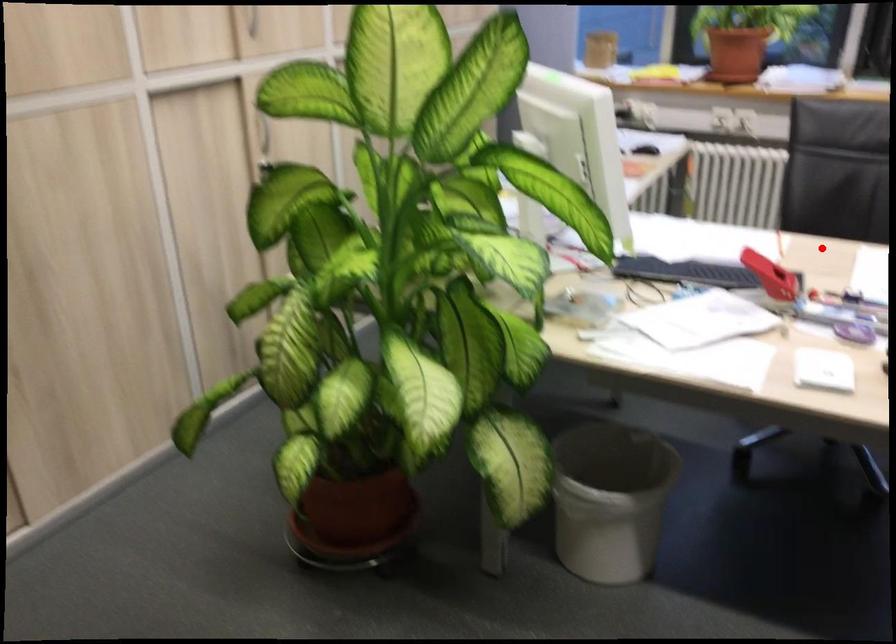
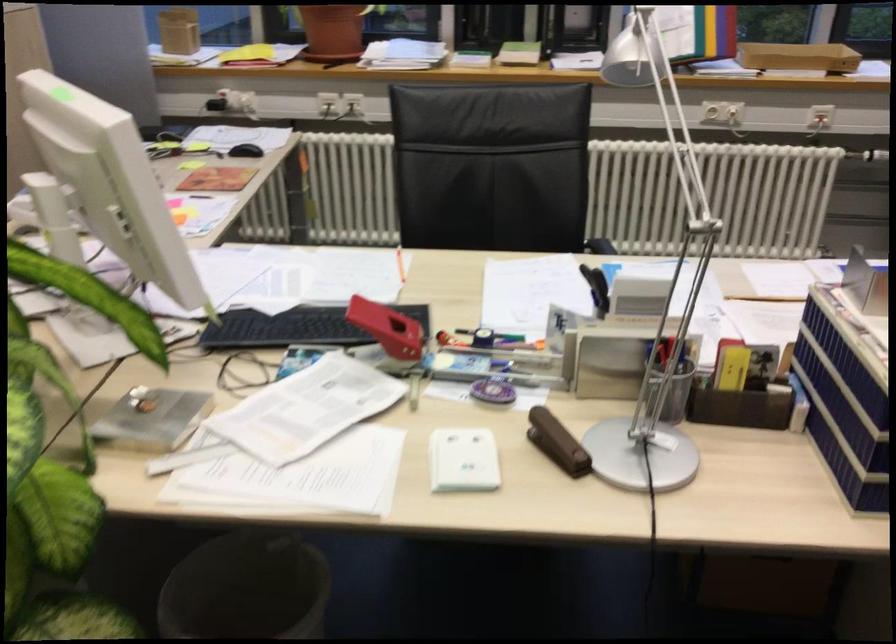
In the second image, find the point that corresponds to the highlighted location in the first image.

(453, 265)